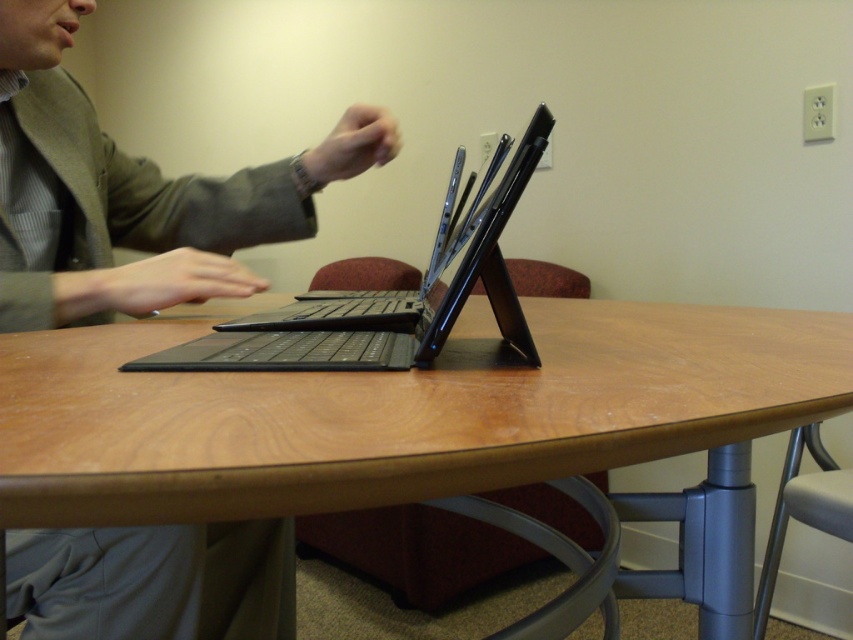
Between matte black laptop at center and black matte laptop at center, which one has less height?

black matte laptop at center

Is matte black laptop at center to the right of black matte laptop at center from the viewer's perspective?

Incorrect, matte black laptop at center is not on the right side of black matte laptop at center.

Who is more forward, (113, 241) or (503, 204)?

Point (503, 204)

Where is `matte black laptop at center`? matte black laptop at center is located at coordinates (132, 193).

Does wooden table at center appear on the left side of black matte laptop at center?

In fact, wooden table at center is to the right of black matte laptop at center.

At what (x,y) coordinates should I click in order to perform the action: click on wooden table at center. Please return your answer as a coordinate pair (x, y). Looking at the image, I should click on (396, 413).

Can you confirm if wooden table at center is wider than matte black laptop at center?

Yes, wooden table at center is wider than matte black laptop at center.

Is wooden table at center smaller than matte black laptop at center?

Yes.

Is point (437, 416) closer to viewer compared to point (62, 32)?

Yes, point (437, 416) is closer to viewer.

Image resolution: width=853 pixels, height=640 pixels. In order to click on wooden table at center in this screenshot , I will do `click(396, 413)`.